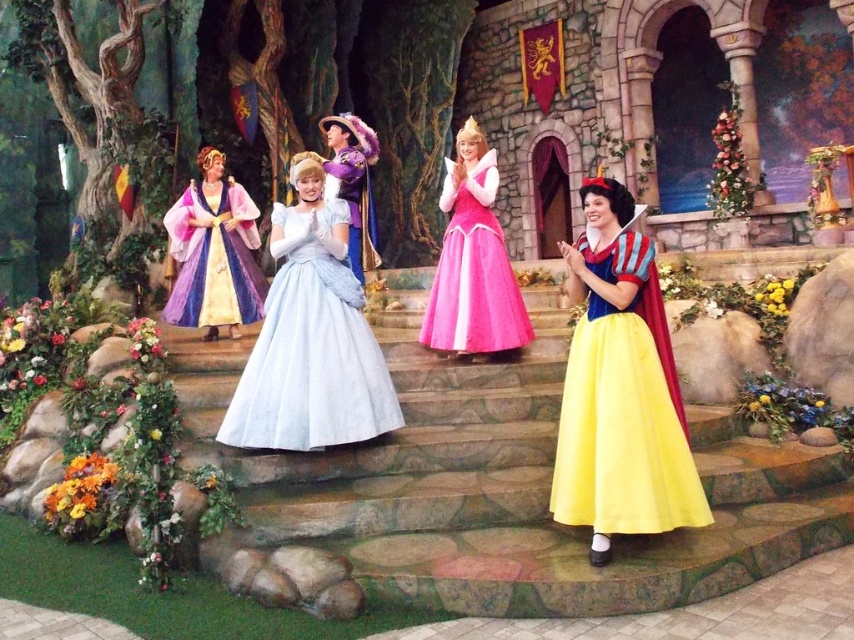
Can you confirm if light blue satin dress at center is smaller than pink satin dress at center?

No, light blue satin dress at center is not smaller than pink satin dress at center.

Which is above, light blue satin dress at center or pink satin dress at center?

pink satin dress at center is higher up.

Is point (275, 429) closer to viewer compared to point (455, 310)?

Yes, point (275, 429) is in front of point (455, 310).

Locate an element on the screen. The width and height of the screenshot is (854, 640). light blue satin dress at center is located at coordinates (311, 348).

Measure the distance from yellow satin dress at center to light blue satin dress at center.

yellow satin dress at center is 1.98 meters from light blue satin dress at center.

Is point (665, 355) in front of point (390, 392)?

Yes, it is.

Identify the location of yellow satin dress at center. This screenshot has height=640, width=854. 624,408.

Can you confirm if pink satin dress at center is bigger than purple satin dress at center?

Yes.

Is point (487, 212) more distant than point (366, 172)?

No, it is in front of (366, 172).

Between point (506, 275) and point (349, 262), which one is positioned behind?

Point (349, 262)

Where is `pink satin dress at center`? pink satin dress at center is located at coordinates (472, 273).